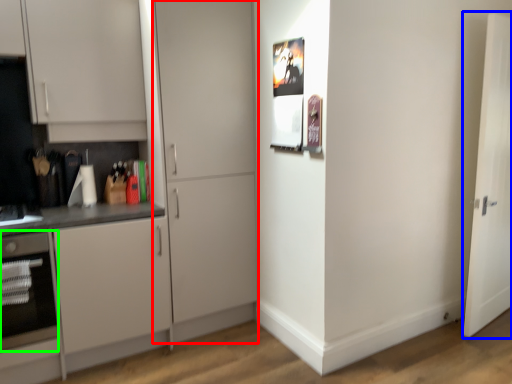
Question: Based on their relative distances, which object is farther from door (highlighted by a red box)? Choose from door (highlighted by a blue box) and oven (highlighted by a green box).

Choices:
 (A) door
 (B) oven

Answer: (A)